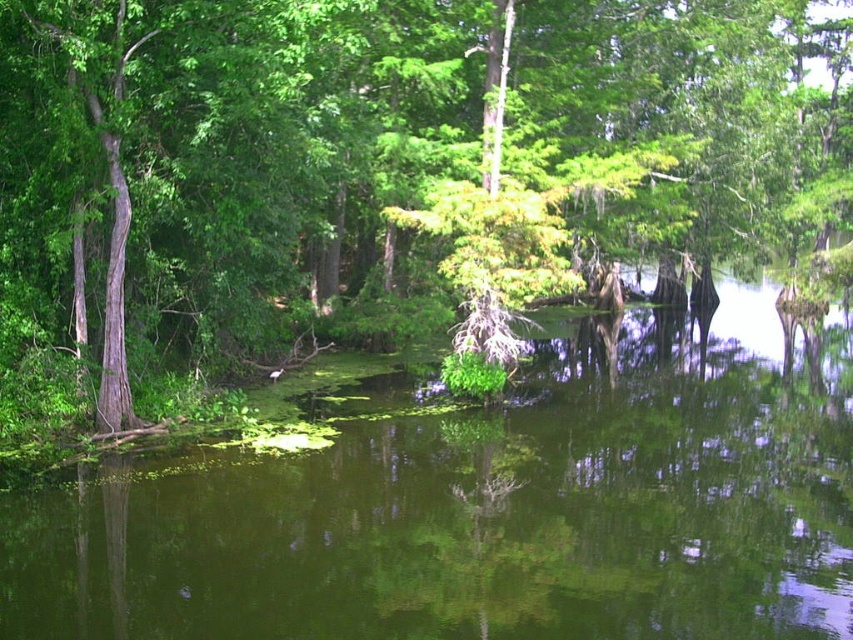
In the swamp scene, there is a green leafy tree at center and a green algae at center. Which one is positioned to the right of the other?

The green leafy tree at center is positioned to the right of the green algae at center.

You are navigating a small boat in the swamp and see two points of interest marked on your map. The first is at point (320, 60) and the second is at point (136, 586). Which point is closer to you if you are facing north?

Point (136, 586) is closer to you because it is in front of point (320, 60) when facing north.